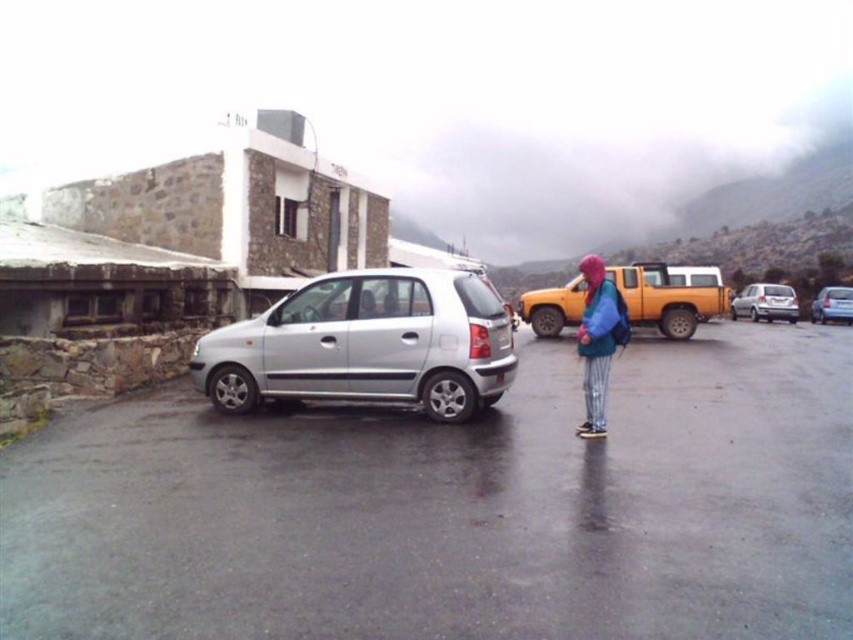
Is point (206, 362) behind point (793, 308)?

No, (206, 362) is in front of (793, 308).

Can you confirm if silver metallic minivan at center-left is shorter than silver metallic hatchback at center-right?

Indeed, silver metallic minivan at center-left has a lesser height compared to silver metallic hatchback at center-right.

Which is behind, point (283, 314) or point (741, 304)?

The point (741, 304) is more distant.

Locate an element on the screen. The image size is (853, 640). silver metallic minivan at center-left is located at coordinates (366, 344).

Is silver metallic minivan at center-left above blue fleece jacket at center?

No.

Who is more forward, (413, 385) or (608, 362)?

Positioned in front is point (608, 362).

Where is `silver metallic minivan at center-left`? silver metallic minivan at center-left is located at coordinates (366, 344).

Between orange matte truck at right and silver metallic hatchback at center-right, which one has less height?

With less height is silver metallic hatchback at center-right.

You are a GUI agent. You are given a task and a screenshot of the screen. Output one action in this format:
    pyautogui.click(x=<x>, y=<y>)
    Task: Click on the orange matte truck at right
    
    Given the screenshot: What is the action you would take?
    click(668, 298)

Find the location of `orange matte truck at right`. orange matte truck at right is located at coordinates (668, 298).

In order to click on orange matte truck at right in this screenshot , I will do `click(668, 298)`.